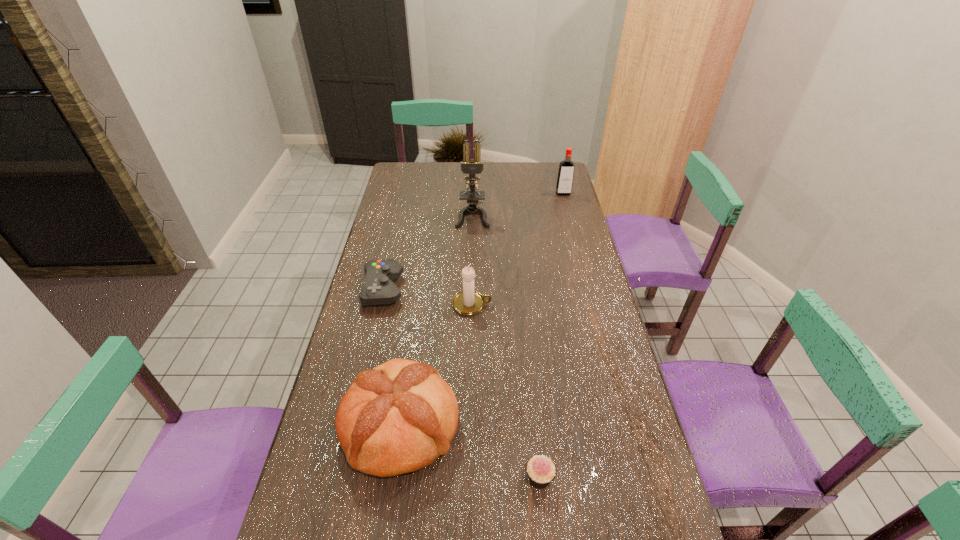
Locate an element on the screen. The image size is (960, 540). free region at the far right corner of the desktop is located at coordinates (554, 171).

I want to click on free space between the candle holder and the tallest object, so click(472, 260).

You are a GUI agent. You are given a task and a screenshot of the screen. Output one action in this format:
    pyautogui.click(x=<x>, y=<y>)
    Task: Click on the blank region between the control and the bread
    Image resolution: width=960 pixels, height=540 pixels.
    Given the screenshot: What is the action you would take?
    pyautogui.click(x=392, y=357)

Locate an element on the screen. The image size is (960, 540). free area in between the rightmost object and the second object from right to left is located at coordinates (551, 336).

I want to click on unoccupied area between the vodka and the control, so click(x=473, y=241).

Find the location of a particular element. The height and width of the screenshot is (540, 960). free space between the control and the cupcake is located at coordinates (462, 384).

This screenshot has width=960, height=540. Find the location of `empty location between the bread and the second tallest object`. empty location between the bread and the second tallest object is located at coordinates (482, 309).

Identify the location of vacant space that's between the bread and the tallest object. The height and width of the screenshot is (540, 960). (437, 321).

This screenshot has height=540, width=960. Find the location of `object that ranks as the fifth closest to the rightmost object`. object that ranks as the fifth closest to the rightmost object is located at coordinates [541, 470].

Image resolution: width=960 pixels, height=540 pixels. Find the location of `object that is the closest to the tallest object`. object that is the closest to the tallest object is located at coordinates (379, 288).